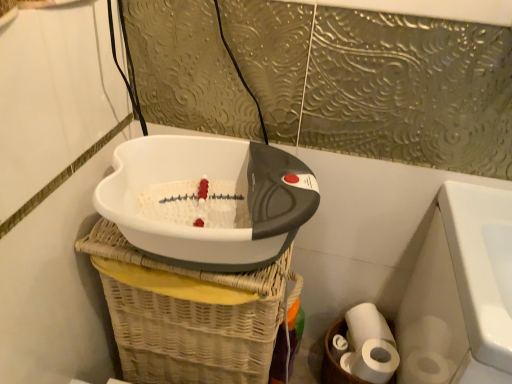
Question: From the image's perspective, does white matte toilet paper at lower right appear higher than white plastic footbath at center?

Choices:
 (A) no
 (B) yes

Answer: (A)

Question: Is white matte toilet paper at lower right positioned with its back to white plastic footbath at center?

Choices:
 (A) yes
 (B) no

Answer: (B)

Question: Is white matte toilet paper at lower right outside of white plastic footbath at center?

Choices:
 (A) no
 (B) yes

Answer: (B)

Question: Is white plastic footbath at center surrounded by white matte toilet paper at lower right?

Choices:
 (A) no
 (B) yes

Answer: (A)

Question: From a real-world perspective, is white matte toilet paper at lower right physically below white plastic footbath at center?

Choices:
 (A) yes
 (B) no

Answer: (A)

Question: Can you confirm if white matte toilet paper at lower right is positioned to the left of white plastic footbath at center?

Choices:
 (A) yes
 (B) no

Answer: (B)

Question: From the image's perspective, is white plastic footbath at center under white matte toilet paper at lower right?

Choices:
 (A) no
 (B) yes

Answer: (A)

Question: Is white plastic footbath at center in front of white matte toilet paper at lower right?

Choices:
 (A) no
 (B) yes

Answer: (B)

Question: Considering the relative positions of white plastic footbath at center and white matte toilet paper at lower right in the image provided, is white plastic footbath at center to the right of white matte toilet paper at lower right from the viewer's perspective?

Choices:
 (A) no
 (B) yes

Answer: (A)

Question: Is the depth of white plastic footbath at center greater than that of white matte toilet paper at lower right?

Choices:
 (A) no
 (B) yes

Answer: (A)

Question: Is white plastic footbath at center positioned far away from white matte toilet paper at lower right?

Choices:
 (A) yes
 (B) no

Answer: (B)

Question: Is the surface of white plastic footbath at center in direct contact with white matte toilet paper at lower right?

Choices:
 (A) no
 (B) yes

Answer: (A)

Question: From the image's perspective, is white matte toilet paper at lower right located above or below white plastic footbath at center?

Choices:
 (A) below
 (B) above

Answer: (A)